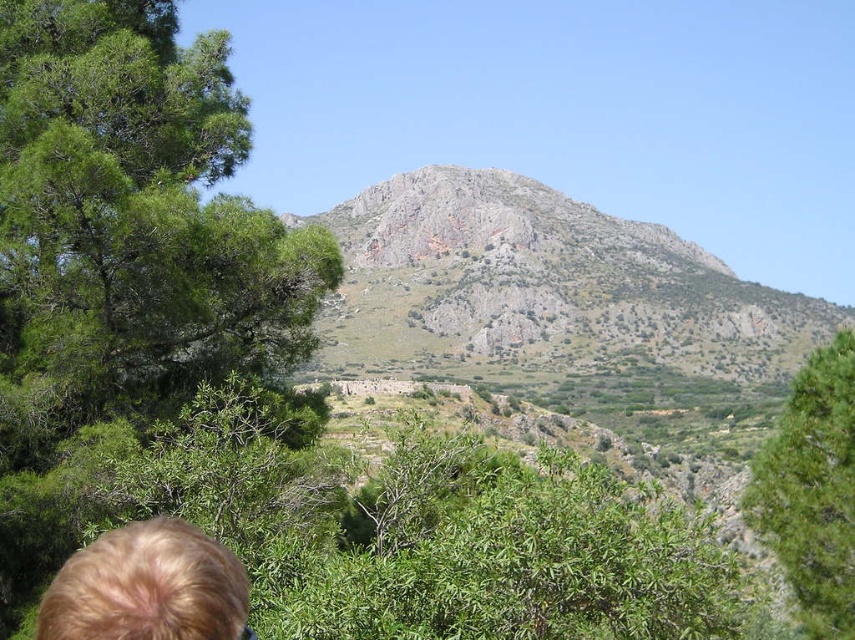
Question: From the image, what is the correct spatial relationship of green leafy tree at center-right in relation to blonde hair at lower left?

Choices:
 (A) left
 (B) right

Answer: (B)

Question: Considering the real-world distances, which object is closest to the green leafy tree at left?

Choices:
 (A) green leafy tree at center-right
 (B) blonde hair at lower left

Answer: (B)

Question: Which of the following is the farthest from the observer?

Choices:
 (A) green leafy tree at left
 (B) blonde hair at lower left

Answer: (A)

Question: Is green leafy tree at left positioned at the back of blonde hair at lower left?

Choices:
 (A) no
 (B) yes

Answer: (B)

Question: Can you confirm if green leafy tree at left is thinner than green leafy tree at center-right?

Choices:
 (A) yes
 (B) no

Answer: (A)

Question: Which of the following is the farthest from the observer?

Choices:
 (A) green leafy tree at left
 (B) green leafy tree at center-right
 (C) blonde hair at lower left

Answer: (B)